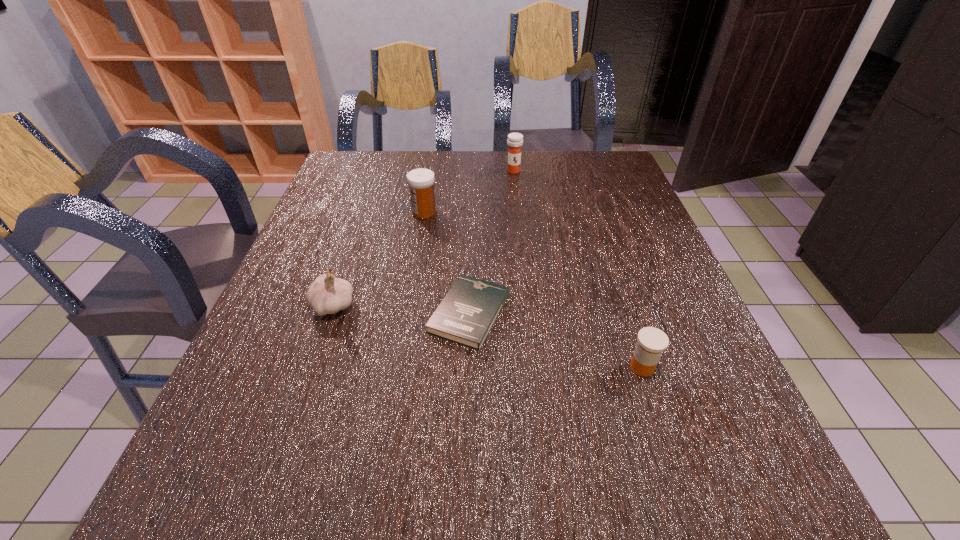
What are the coordinates of `blank space located 0.070m on the front of the fourth nearest object` in the screenshot? It's located at (x=420, y=235).

Locate an element on the screen. free space located 0.070m on the back of the garlic is located at coordinates (346, 269).

What are the coordinates of `free point located 0.240m on the label of the shortest medicine` in the screenshot? It's located at (498, 367).

Locate an element on the screen. This screenshot has width=960, height=540. vacant area located 0.080m on the label of the shortest medicine is located at coordinates (585, 367).

Identify the location of vacant space located on the label of the shortest medicine. (568, 367).

Image resolution: width=960 pixels, height=540 pixels. Identify the location of free location located on the left of the book. (278, 313).

Find the location of a particular element. This screenshot has width=960, height=540. object positioned at the far edge is located at coordinates (515, 140).

In order to click on object situated at the left edge in this screenshot , I will do pyautogui.click(x=327, y=295).

Where is `object positioned at the right edge`? The width and height of the screenshot is (960, 540). object positioned at the right edge is located at coordinates (652, 341).

Identify the location of free space at the far edge of the desktop. The height and width of the screenshot is (540, 960). (482, 167).